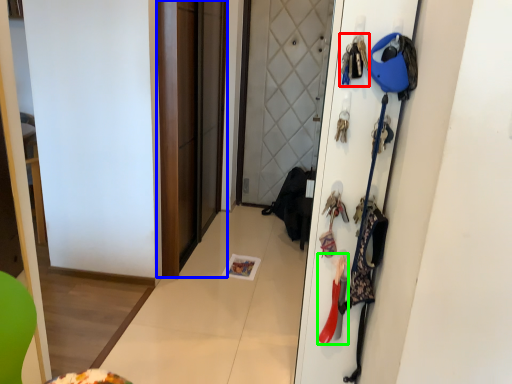
Question: Which is nearer to the accessory (highlighted by a red box)? screen door (highlighted by a blue box) or accessory (highlighted by a green box).

Choices:
 (A) screen door
 (B) accessory

Answer: (B)